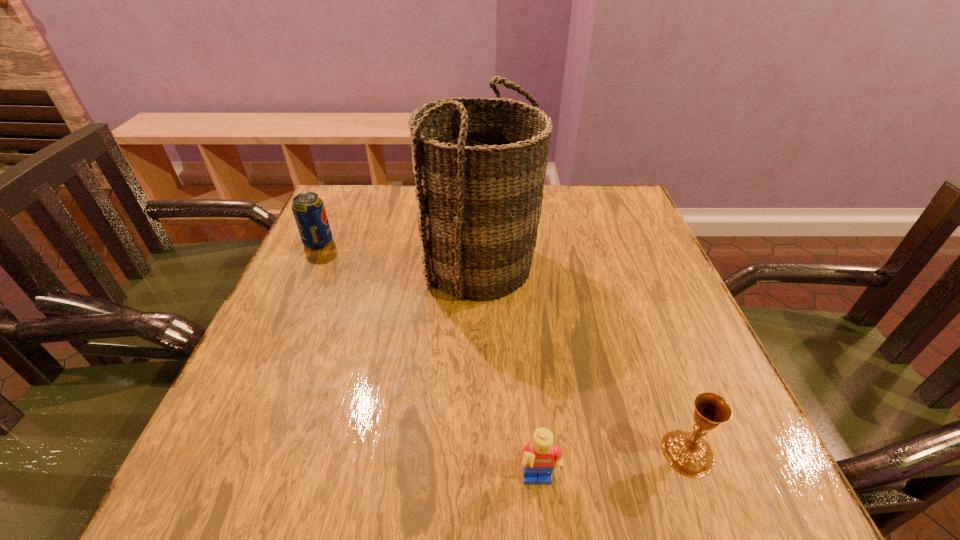
You are a GUI agent. You are given a task and a screenshot of the screen. Output one action in this format:
    pyautogui.click(x=<x>, y=<y>)
    Task: Click on the object positioned at the left edge
    The height and width of the screenshot is (540, 960).
    Given the screenshot: What is the action you would take?
    pyautogui.click(x=308, y=209)

Where is `object located at the right edge`? Image resolution: width=960 pixels, height=540 pixels. object located at the right edge is located at coordinates (688, 453).

Identify the location of object situated at the near right corner. The height and width of the screenshot is (540, 960). (688, 453).

I want to click on vacant area at the far edge of the desktop, so click(575, 218).

Locate an element on the screen. The width and height of the screenshot is (960, 540). blank space at the left edge is located at coordinates (254, 429).

I want to click on free region at the right edge of the desktop, so click(x=619, y=248).

What are the coordinates of `free region at the far left corner` in the screenshot? It's located at point(351,218).

This screenshot has width=960, height=540. I want to click on vacant area at the far right corner of the desktop, so click(611, 191).

Where is `free space at the near right corner of the desktop`? This screenshot has height=540, width=960. free space at the near right corner of the desktop is located at coordinates (733, 501).

Identify the location of vacant space that is in between the rightmost object and the basket. (584, 359).